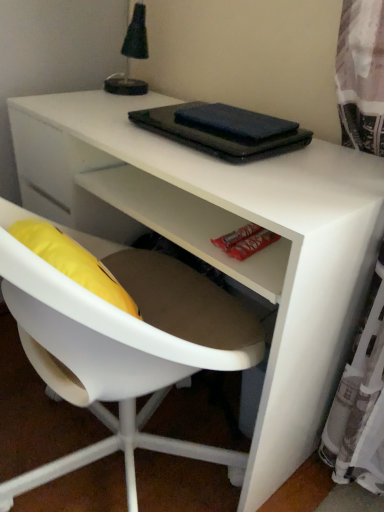
Question: Which direction should I rotate to look at black matte notebook at center, the 2th notebook positioned from the top, — up or down?

Choices:
 (A) down
 (B) up

Answer: (B)

Question: Is black matte notebook at center, the 2th notebook positioned from the top, thinner than dark blue matte notebook at upper center, which appears as the first notebook when viewed from the top?

Choices:
 (A) no
 (B) yes

Answer: (A)

Question: Could you tell me if black matte notebook at center, the 2th notebook positioned from the top, is facing dark blue matte notebook at upper center, the second notebook positioned from the bottom?

Choices:
 (A) yes
 (B) no

Answer: (B)

Question: From the image's perspective, is black matte notebook at center, which is the first notebook from bottom to top, on top of dark blue matte notebook at upper center, the second notebook positioned from the bottom?

Choices:
 (A) no
 (B) yes

Answer: (A)

Question: Does black matte notebook at center, the 2th notebook positioned from the top, have a greater width compared to dark blue matte notebook at upper center, which appears as the first notebook when viewed from the top?

Choices:
 (A) no
 (B) yes

Answer: (B)

Question: From a real-world perspective, does black matte notebook at center, which is the first notebook from bottom to top, stand above dark blue matte notebook at upper center, the second notebook positioned from the bottom?

Choices:
 (A) yes
 (B) no

Answer: (B)

Question: Is black matte notebook at center, which is the first notebook from bottom to top, at the left side of dark blue matte notebook at upper center, the second notebook positioned from the bottom?

Choices:
 (A) no
 (B) yes

Answer: (B)

Question: Does dark blue matte notebook at upper center, the second notebook positioned from the bottom, lie in front of black matte notebook at center, which is the first notebook from bottom to top?

Choices:
 (A) no
 (B) yes

Answer: (A)

Question: Does dark blue matte notebook at upper center, which appears as the first notebook when viewed from the top, have a greater height compared to black matte notebook at center, the 2th notebook positioned from the top?

Choices:
 (A) yes
 (B) no

Answer: (B)

Question: Is dark blue matte notebook at upper center, which appears as the first notebook when viewed from the top, to the right of black matte notebook at center, which is the first notebook from bottom to top, from the viewer's perspective?

Choices:
 (A) yes
 (B) no

Answer: (A)

Question: From the image's perspective, is dark blue matte notebook at upper center, the second notebook positioned from the bottom, above black matte notebook at center, which is the first notebook from bottom to top?

Choices:
 (A) no
 (B) yes

Answer: (B)

Question: Does dark blue matte notebook at upper center, the second notebook positioned from the bottom, come behind black matte notebook at center, the 2th notebook positioned from the top?

Choices:
 (A) yes
 (B) no

Answer: (A)

Question: Is dark blue matte notebook at upper center, which appears as the first notebook when viewed from the top, to the left of black matte notebook at center, the 2th notebook positioned from the top, from the viewer's perspective?

Choices:
 (A) yes
 (B) no

Answer: (B)

Question: Can you confirm if black matte notebook at center, the 2th notebook positioned from the top, is thinner than black fabric lampshade at upper left?

Choices:
 (A) yes
 (B) no

Answer: (B)